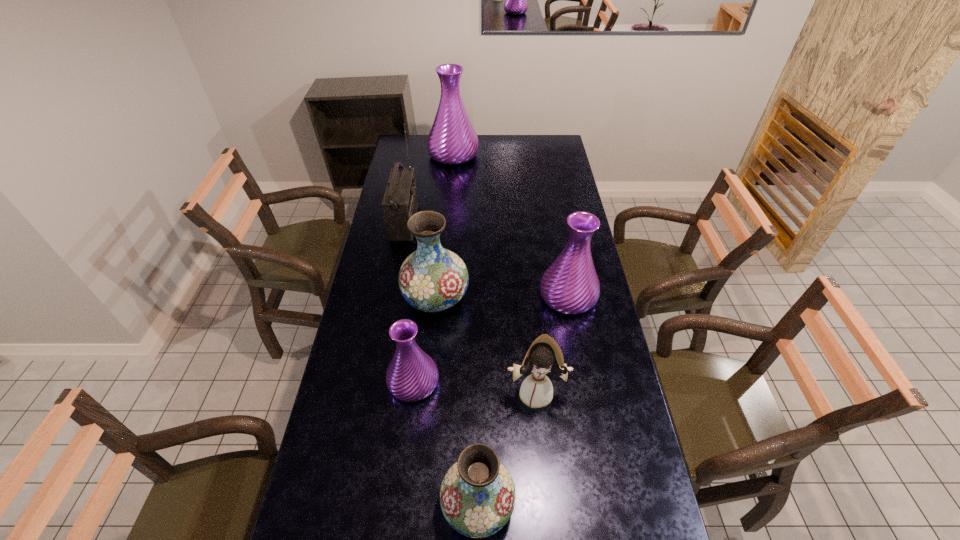
Identify the location of vacant space located on the left of the farthest vase. (400, 155).

Where is `free location located 0.080m on the front panel of the second farthest object`? free location located 0.080m on the front panel of the second farthest object is located at coordinates (434, 221).

Where is `vacant space located on the left of the second smallest purple vase`? vacant space located on the left of the second smallest purple vase is located at coordinates (496, 296).

Locate an element on the screen. The image size is (960, 540). free point located 0.270m on the back of the bigger blue vase is located at coordinates (442, 229).

Locate an element on the screen. Image resolution: width=960 pixels, height=540 pixels. free space located 0.150m at the front face of the black doll is located at coordinates (542, 460).

Locate an element on the screen. vacant area situated 0.190m on the back of the smallest purple vase is located at coordinates (421, 315).

Find the location of a particular element. The width and height of the screenshot is (960, 540). object located at the far edge is located at coordinates (452, 140).

Where is `radio receiver that is at the left edge`? The height and width of the screenshot is (540, 960). radio receiver that is at the left edge is located at coordinates (400, 202).

Locate an element on the screen. This screenshot has height=540, width=960. object that is at the right edge is located at coordinates (570, 285).

Locate an element on the screen. vacant space at the far edge is located at coordinates (515, 148).